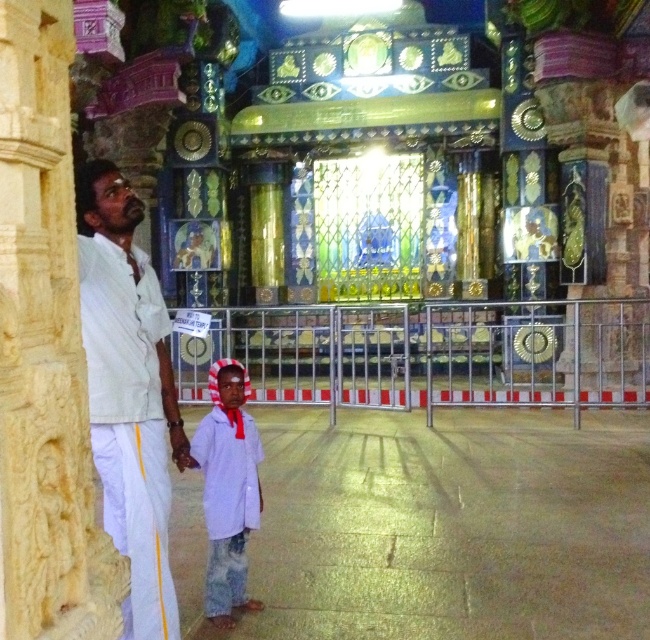
The image size is (650, 640). I want to click on white cotton shirt at left, so click(127, 394).

Does point (101, 268) come behind point (237, 545)?

No.

Between point (117, 541) and point (237, 564), which one is positioned in front?

Point (117, 541) is in front.

Find the location of a particular element. The width and height of the screenshot is (650, 640). white cotton shirt at left is located at coordinates (127, 394).